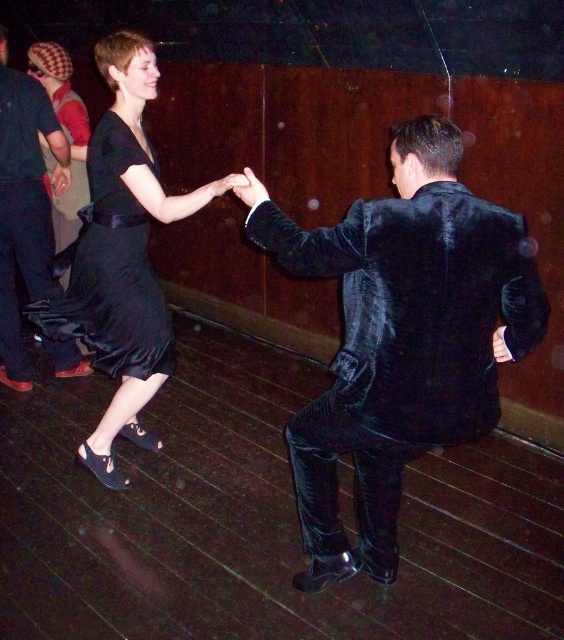
You are a photographer at the event and want to capture a photo where both the velvet black suit at right and the black satin dress at upper left are visible. Given their heights, which object should you position closer to the camera to ensure both are fully visible in the frame?

The velvet black suit at right is not as tall as the black satin dress at upper left. To ensure both are fully visible, position the velvet black suit at right closer to the camera since it is shorter and might be obscured by the taller black satin dress at upper left if placed further back.

You are a photographer at the event and want to capture a photo of both the velvet black suit at right and the satin black dress at center. To ensure both are in frame, should you adjust your camera to the left or right?

The velvet black suit at right is to the right of the satin black dress at center. To include both in the frame, adjust your camera to the left to capture the entire scene.

You are a photographer at the event and need to capture a photo where both the velvet black suit at right and the satin black dress at center are clearly visible. Given their height difference, where should you position your camera to ensure both are fully in frame?

The velvet black suit at right is much taller than the satin black dress at center. To ensure both are fully visible, position the camera at a mid to lower height so the shorter satin black dress at center isn not obscured by the taller velvet black suit at right.